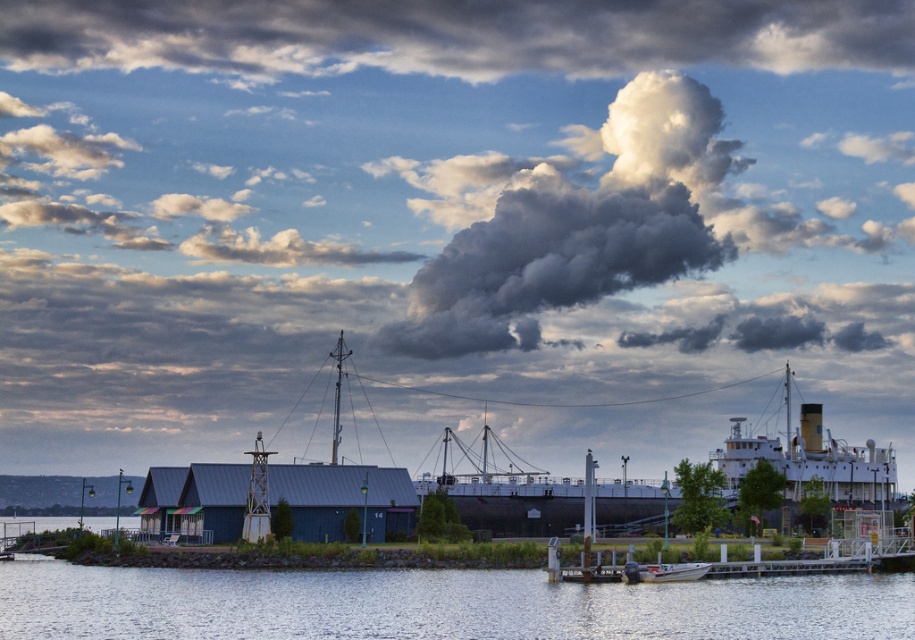
Question: Is clear water at lower center below white glossy ship at upper right?

Choices:
 (A) no
 (B) yes

Answer: (B)

Question: Is cloudy cotton candy at upper center positioned behind white glossy ship at upper right?

Choices:
 (A) yes
 (B) no

Answer: (A)

Question: Among these points, which one is nearest to the camera?

Choices:
 (A) (736, 36)
 (B) (668, 564)
 (C) (519, 609)
 (D) (458, 330)

Answer: (C)

Question: Where is cloudy cotton candy at upper center located in relation to white glossy ship at upper right in the image?

Choices:
 (A) left
 (B) right

Answer: (A)

Question: Which of the following is the farthest from the observer?

Choices:
 (A) (792, 605)
 (B) (674, 579)

Answer: (B)

Question: Which point appears closest to the camera in this image?

Choices:
 (A) (507, 164)
 (B) (706, 566)
 (C) (803, 474)
 (D) (584, 593)

Answer: (D)